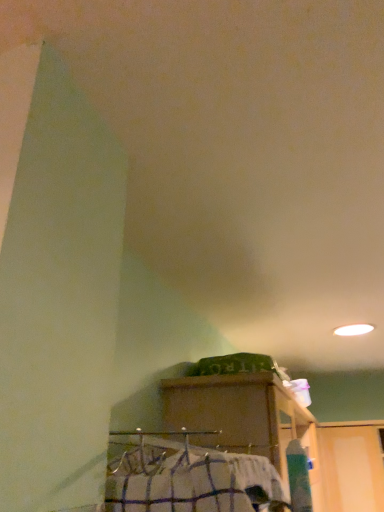
Question: Is wooden cabinet at lower center in front of or behind white checkered shirt at lower center in the image?

Choices:
 (A) front
 (B) behind

Answer: (B)

Question: Is wooden cabinet at lower center bigger or smaller than white checkered shirt at lower center?

Choices:
 (A) big
 (B) small

Answer: (A)

Question: Looking at their shapes, would you say wooden cabinet at lower center is wider or thinner than white checkered shirt at lower center?

Choices:
 (A) wide
 (B) thin

Answer: (A)

Question: Based on their positions, is white checkered shirt at lower center located to the left or right of wooden cabinet at lower center?

Choices:
 (A) left
 (B) right

Answer: (A)

Question: Considering their positions, is white checkered shirt at lower center located in front of or behind wooden cabinet at lower center?

Choices:
 (A) behind
 (B) front

Answer: (B)

Question: Is point (152, 478) positioned closer to the camera than point (216, 434)?

Choices:
 (A) farther
 (B) closer

Answer: (B)

Question: In terms of size, does white checkered shirt at lower center appear bigger or smaller than wooden cabinet at lower center?

Choices:
 (A) small
 (B) big

Answer: (A)